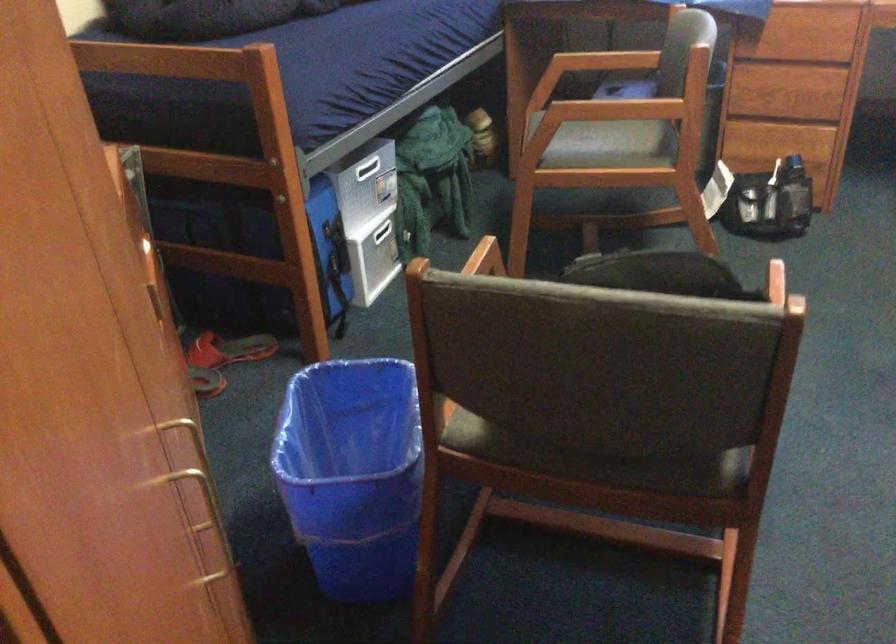
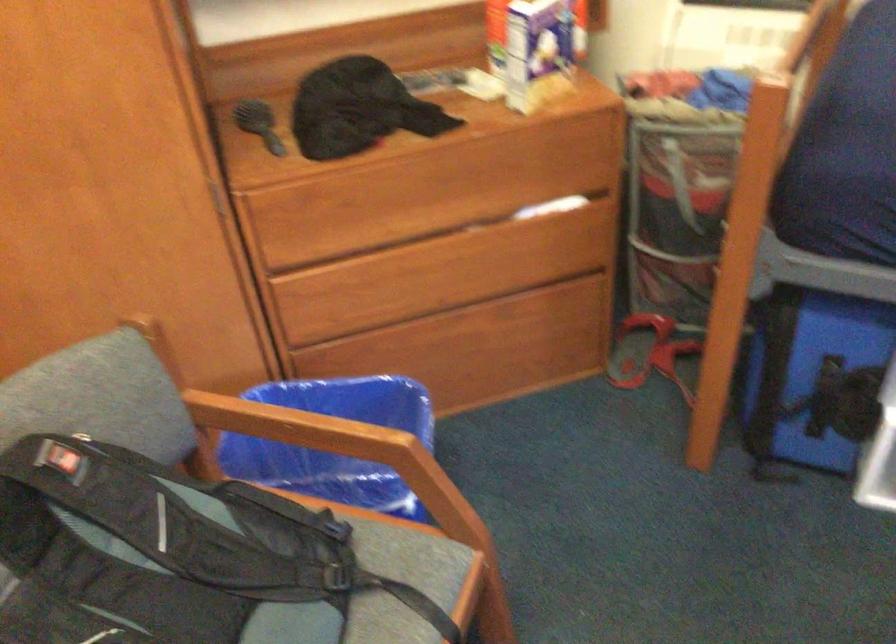
Find the pixel in the second image that matches point 432,295 in the first image.

(290, 424)